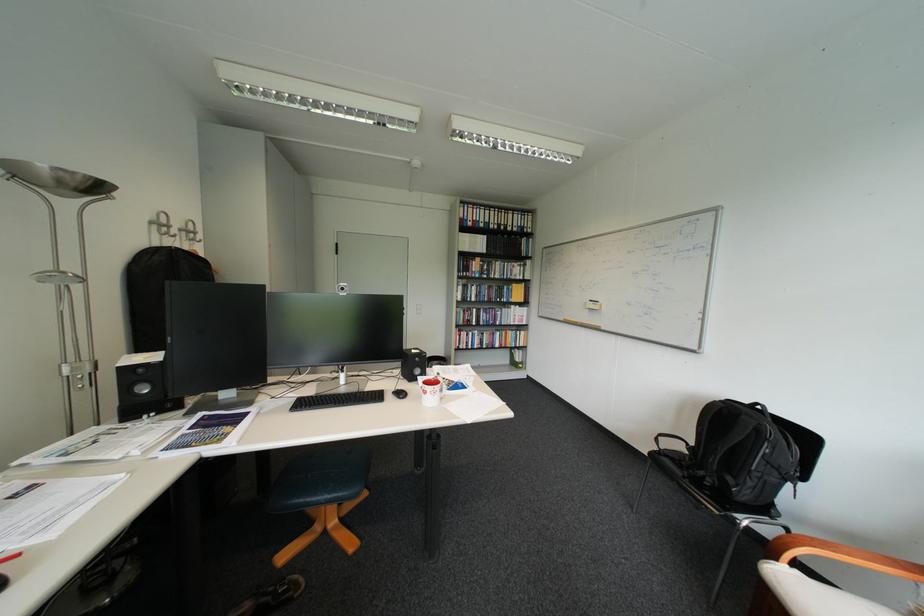
Where would you press the black computer keyboard? Please return your answer as a coordinate pair (x, y).

(335, 400)